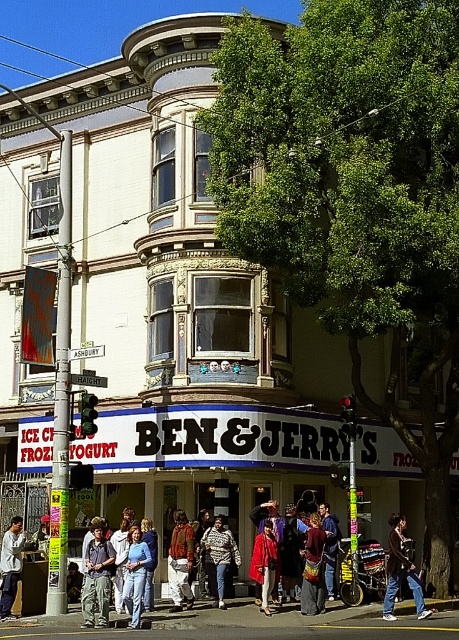
Is multicolored woven bag at center shorter than denim jacket at lower left?

Yes, multicolored woven bag at center is shorter than denim jacket at lower left.

Can you confirm if multicolored woven bag at center is wider than denim jacket at lower left?

Incorrect, multicolored woven bag at center's width does not surpass denim jacket at lower left's.

Between point (301, 596) and point (15, 531), which one is positioned behind?

Point (15, 531)

Locate an element on the screen. multicolored woven bag at center is located at coordinates (313, 568).

Is multicolored woven bag at center to the left of red fabric dress at center from the viewer's perspective?

No, multicolored woven bag at center is not to the left of red fabric dress at center.

What do you see at coordinates (313, 568) in the screenshot? This screenshot has width=459, height=640. I see `multicolored woven bag at center` at bounding box center [313, 568].

The height and width of the screenshot is (640, 459). I want to click on multicolored woven bag at center, so (313, 568).

You are a GUI agent. You are given a task and a screenshot of the screen. Output one action in this format:
    pyautogui.click(x=<x>, y=<y>)
    Task: Click on the orange and brown striped shirt at center
    This screenshot has height=640, width=459.
    Given the screenshot: What is the action you would take?
    pyautogui.click(x=180, y=561)

Does point (173, 515) come farther from viewer compared to point (139, 579)?

Yes, point (173, 515) is farther from viewer.

Where is `orange and brown striped shirt at center`? This screenshot has width=459, height=640. orange and brown striped shirt at center is located at coordinates (180, 561).